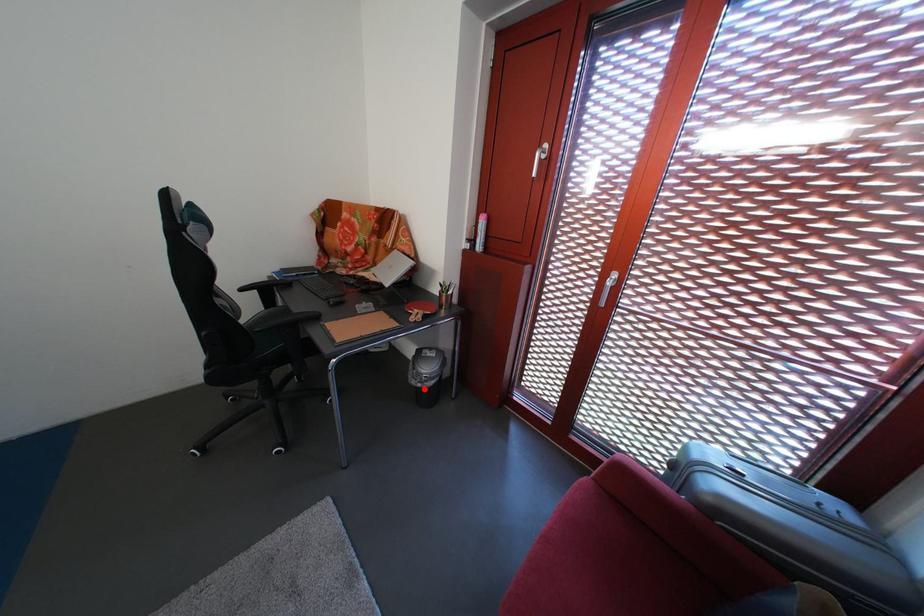
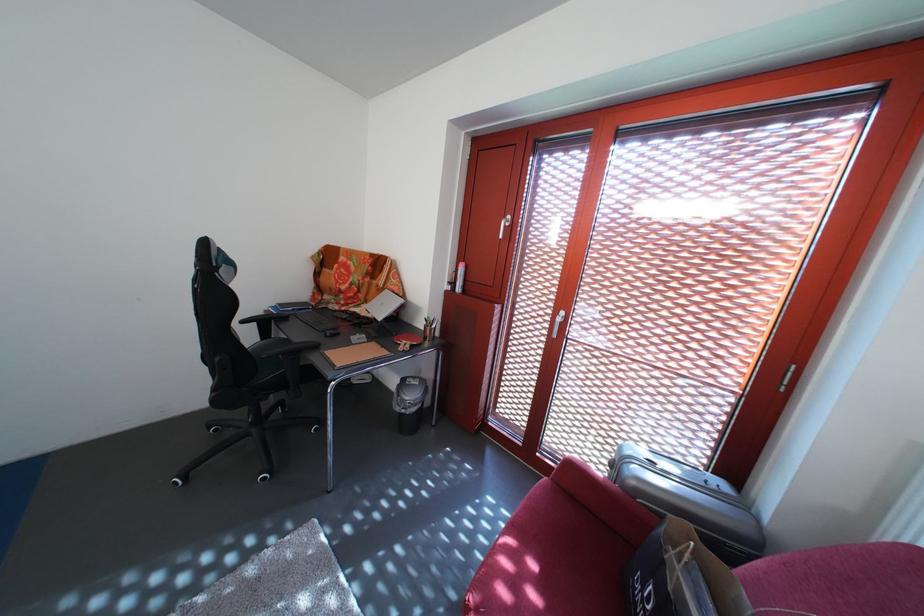
Locate, in the second image, the point that corresponds to the highlighted location in the first image.

(408, 416)